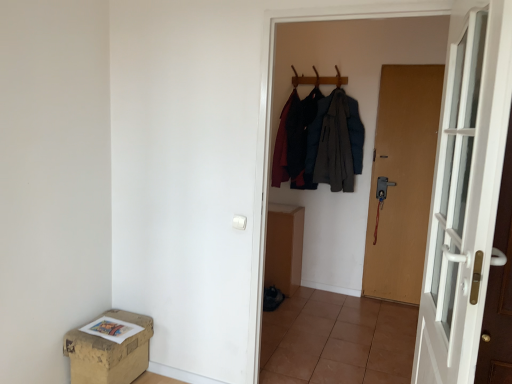
The image size is (512, 384). Find the location of `free spot above brown matte door at right, arranged as the first door when viewed from the right (from a real-world perspective)`. free spot above brown matte door at right, arranged as the first door when viewed from the right (from a real-world perspective) is located at coordinates (415, 67).